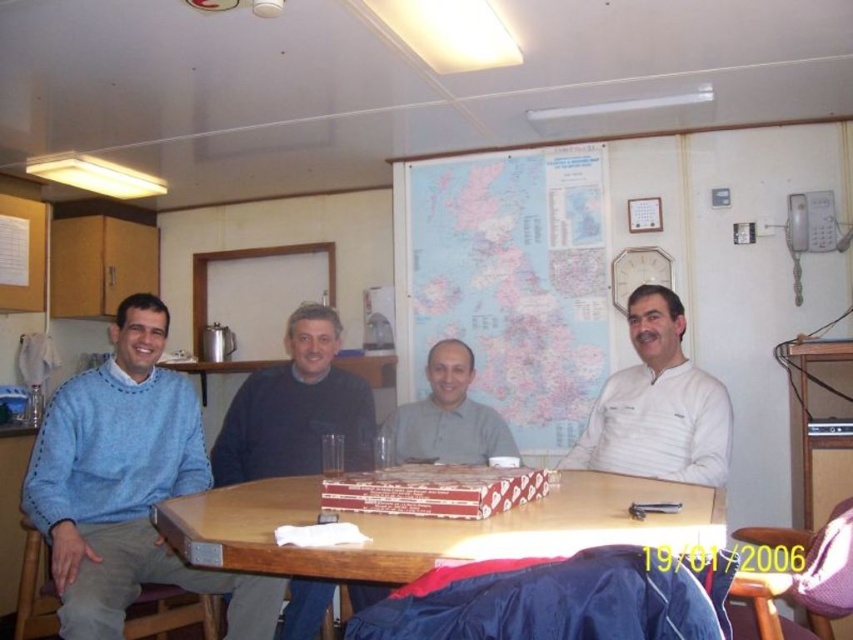
Question: Does map paper at center have a lesser width compared to wooden table at center?

Choices:
 (A) yes
 (B) no

Answer: (A)

Question: Which object appears closest to the camera in this image?

Choices:
 (A) wooden table at center
 (B) light brown shirt at center
 (C) white matte shirt at center

Answer: (A)

Question: Which point is closer to the camera?

Choices:
 (A) white matte shirt at center
 (B) map paper at center

Answer: (A)

Question: Is map paper at center smaller than wooden table at center?

Choices:
 (A) no
 (B) yes

Answer: (A)

Question: Among these objects, which one is farthest from the camera?

Choices:
 (A) dark blue sweater at center
 (B) wooden table at center
 (C) map paper at center

Answer: (C)

Question: Does wooden table at center have a smaller size compared to red cardboard pizza boxes at center?

Choices:
 (A) yes
 (B) no

Answer: (B)